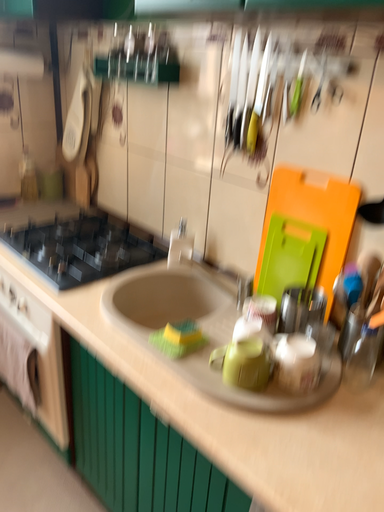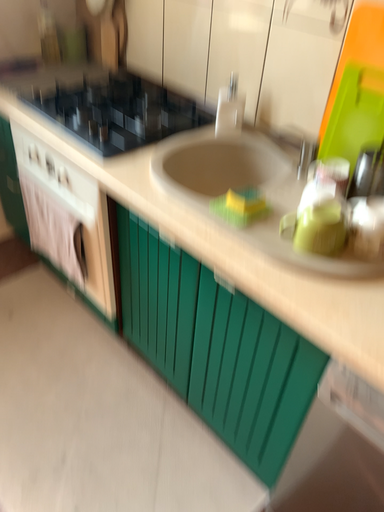
Question: Which way did the camera rotate in the video?

Choices:
 (A) rotated upward
 (B) rotated downward

Answer: (B)